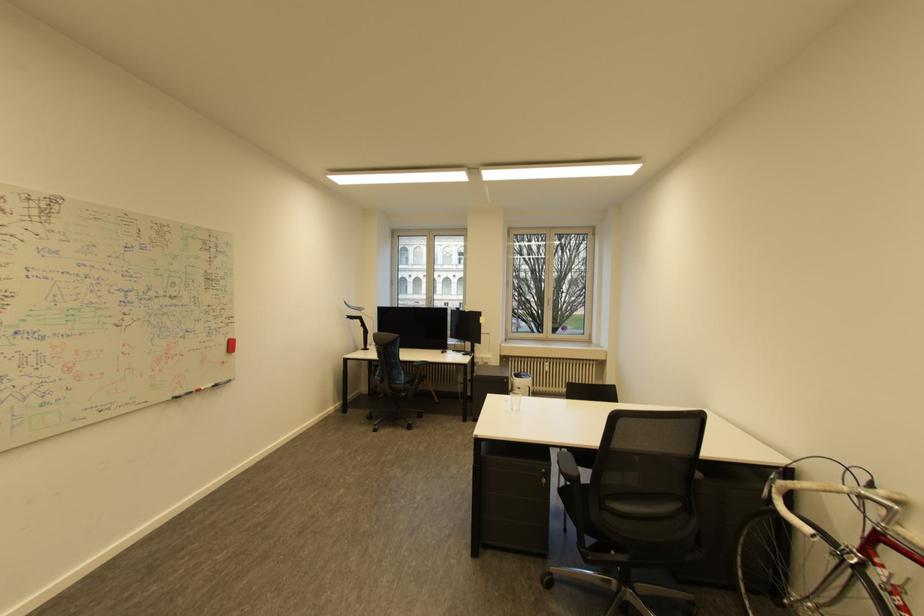
Locate an element on the screen. This screenshot has width=924, height=616. water glass is located at coordinates (515, 400).